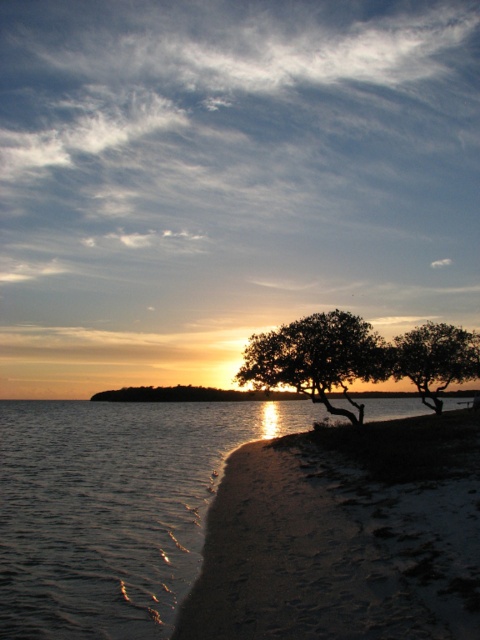
Can you confirm if sandy beach at lower right is smaller than green matte tree at lower right?

No, sandy beach at lower right is not smaller than green matte tree at lower right.

Between point (349, 506) and point (456, 362), which one is positioned in front?

Positioned in front is point (349, 506).

Which is in front, point (253, 548) or point (421, 384)?

Point (253, 548) is more forward.

In order to click on sandy beach at lower right in this screenshot , I will do `click(345, 536)`.

Does silhouette wood tree at center have a greater height compared to green matte tree at lower right?

No, silhouette wood tree at center is not taller than green matte tree at lower right.

Looking at this image, is silhouette wood tree at center closer to the viewer compared to green matte tree at lower right?

That is True.

You are a GUI agent. You are given a task and a screenshot of the screen. Output one action in this format:
    pyautogui.click(x=<x>, y=<y>)
    Task: Click on the silhouette wood tree at center
    This screenshot has height=640, width=480.
    Given the screenshot: What is the action you would take?
    pyautogui.click(x=317, y=356)

You are a GUI agent. You are given a task and a screenshot of the screen. Output one action in this format:
    pyautogui.click(x=<x>, y=<y>)
    Task: Click on the silhouette wood tree at center
    
    Given the screenshot: What is the action you would take?
    pos(317,356)

Does sandy beach at lower right appear on the right side of silhouette wood tree at center?

Incorrect, sandy beach at lower right is not on the right side of silhouette wood tree at center.

Is sandy beach at lower right above silhouette wood tree at center?

Actually, sandy beach at lower right is below silhouette wood tree at center.

In order to click on sandy beach at lower right in this screenshot , I will do `click(345, 536)`.

Where is `sandy beach at lower right`? This screenshot has width=480, height=640. sandy beach at lower right is located at coordinates (345, 536).